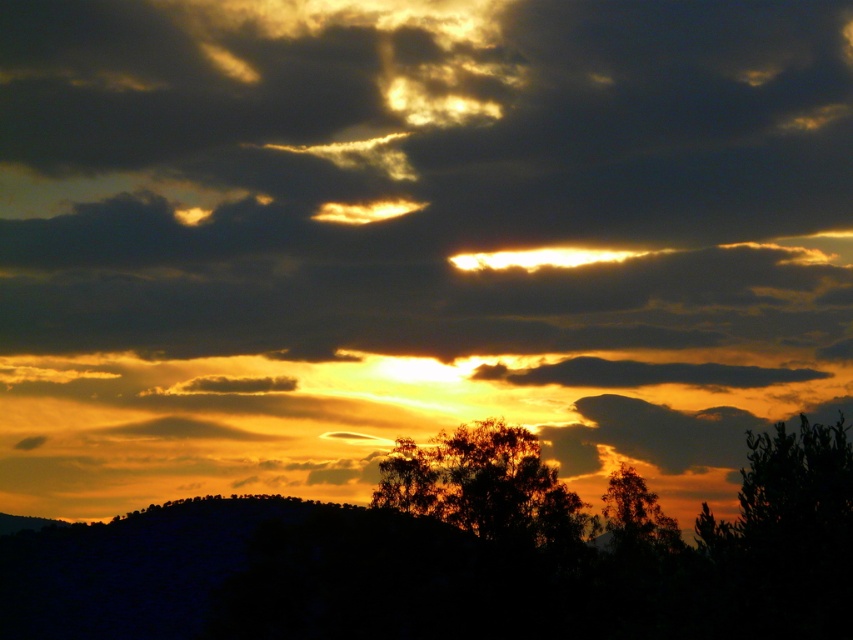
Is point (509, 506) behind point (627, 528)?

No, (509, 506) is closer to viewer.

Between silhouetted foliage at center and dark green leafy tree at right, which one appears on the right side from the viewer's perspective?

Positioned to the right is dark green leafy tree at right.

Where is `silhouetted foliage at center`? Image resolution: width=853 pixels, height=640 pixels. silhouetted foliage at center is located at coordinates (482, 484).

Image resolution: width=853 pixels, height=640 pixels. Find the location of `silhouetted foliage at center`. silhouetted foliage at center is located at coordinates (482, 484).

Between dark green leafy tree at lower right and dark green leafy tree at right, which one has more height?

dark green leafy tree at lower right

Between dark green leafy tree at lower right and dark green leafy tree at right, which one is positioned higher?

Positioned higher is dark green leafy tree at lower right.

Which is behind, point (781, 456) or point (634, 540)?

The point (634, 540) is more distant.

Where is `dark green leafy tree at lower right`? The width and height of the screenshot is (853, 640). dark green leafy tree at lower right is located at coordinates (788, 504).

Who is more distant from viewer, (532, 529) or (799, 451)?

The point (532, 529) is more distant.

Is silhouetted foliage at center smaller than dark green leafy tree at lower right?

Incorrect, silhouetted foliage at center is not smaller in size than dark green leafy tree at lower right.

Which is in front, point (543, 544) or point (828, 528)?

Point (828, 528) is more forward.

Identify the location of silhouetted foliage at center. The height and width of the screenshot is (640, 853). (482, 484).